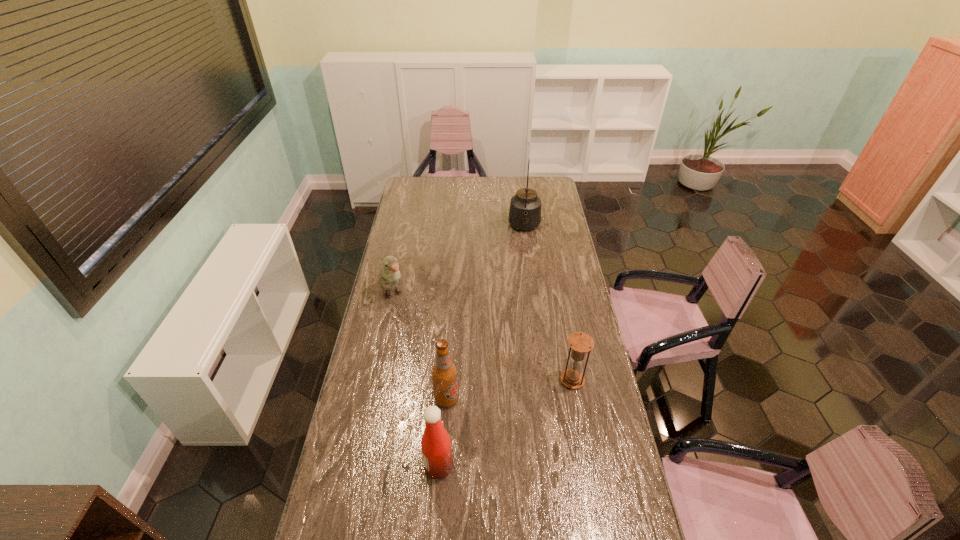
Locate an element on the screen. free space between the fourth nearest object and the hourglass is located at coordinates (482, 338).

You are a GUI agent. You are given a task and a screenshot of the screen. Output one action in this format:
    pyautogui.click(x=<x>, y=<y>)
    Task: Click on the free point between the farthest object and the fourth nearest object
    The width and height of the screenshot is (960, 540).
    Given the screenshot: What is the action you would take?
    pyautogui.click(x=459, y=261)

This screenshot has width=960, height=540. What are the coordinates of `empty space that is in between the second farthest object and the nearest object` in the screenshot? It's located at (416, 381).

I want to click on blank region between the nearest object and the hourglass, so click(x=506, y=423).

Locate an element on the screen. This screenshot has height=540, width=960. vacant space that's between the leftmost object and the hourglass is located at coordinates (482, 338).

You are a GUI agent. You are given a task and a screenshot of the screen. Output one action in this format:
    pyautogui.click(x=<x>, y=<y>)
    Task: Click on the free space between the hourglass and the kettle
    The width and height of the screenshot is (960, 540).
    Given the screenshot: What is the action you would take?
    pyautogui.click(x=548, y=304)

Find the location of a particular element. The width and height of the screenshot is (960, 540). vacant space that's between the bird and the farthest object is located at coordinates (459, 261).

Point out which object is positioned as the third nearest to the nearest object. Please provide its 2D coordinates. Your answer should be formatted as a tuple, i.e. [(x, y)], where the tuple contains the x and y coordinates of a point satisfying the conditions above.

[(389, 275)]

Locate which object is the third closest to the tallest object. Please provide its 2D coordinates. Your answer should be formatted as a tuple, i.e. [(x, y)], where the tuple contains the x and y coordinates of a point satisfying the conditions above.

[(444, 372)]

Where is `vacant space that satisfies the following two spatial constraints: 1. on the front side of the hourglass; 2. on the right side of the farthest object`? Image resolution: width=960 pixels, height=540 pixels. vacant space that satisfies the following two spatial constraints: 1. on the front side of the hourglass; 2. on the right side of the farthest object is located at coordinates (544, 380).